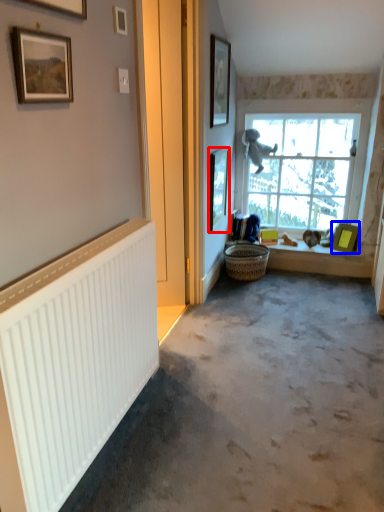
Question: Which object is closer to the camera taking this photo, picture frame (highlighted by a red box) or picture frame (highlighted by a blue box)?

Choices:
 (A) picture frame
 (B) picture frame

Answer: (A)